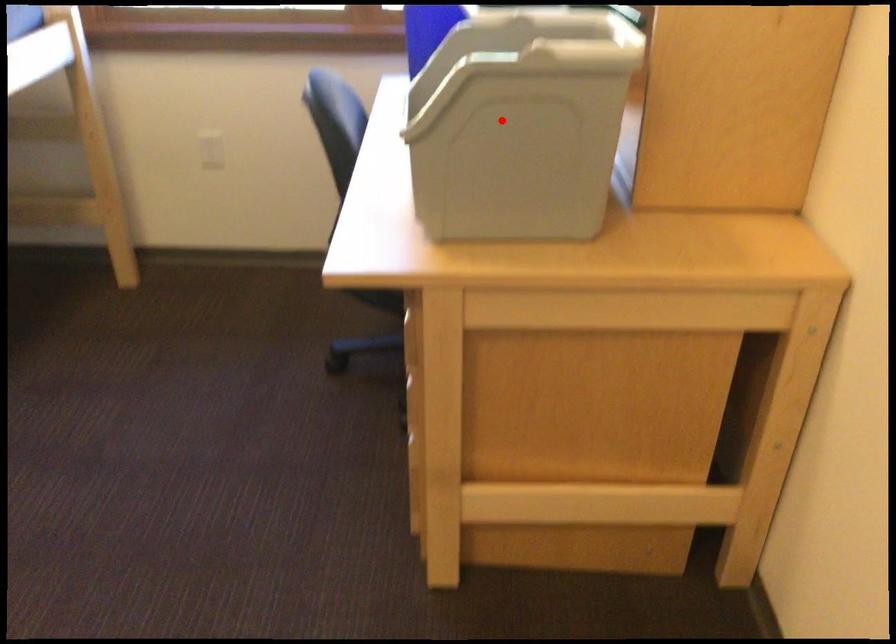
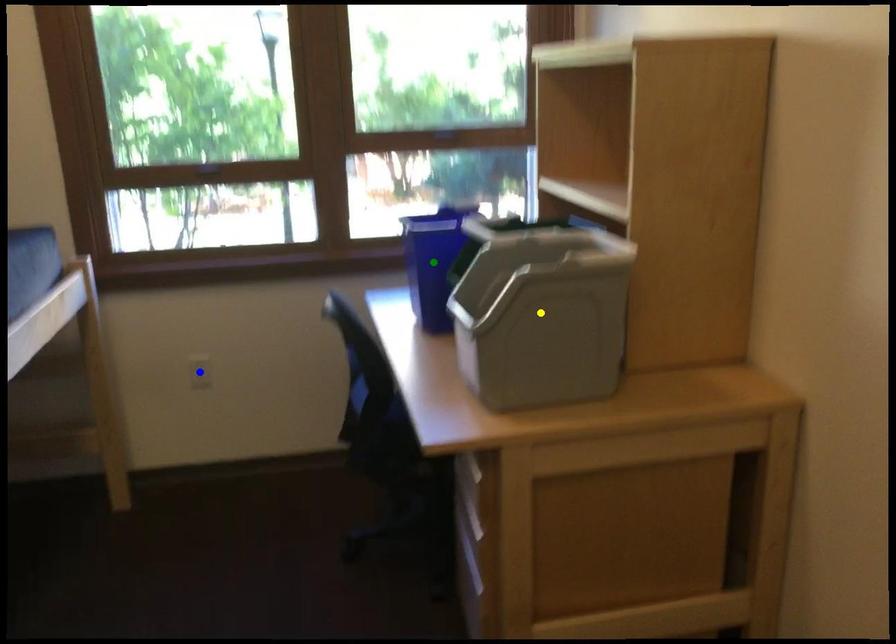
Question: I am providing you with two images of the same scene from different viewpoints. A red point is marked on the first image. You are given multiple points on the second image. In image 2, which mark is for the same physical point as the one in image 1?

Choices:
 (A) green point
 (B) blue point
 (C) yellow point

Answer: (C)